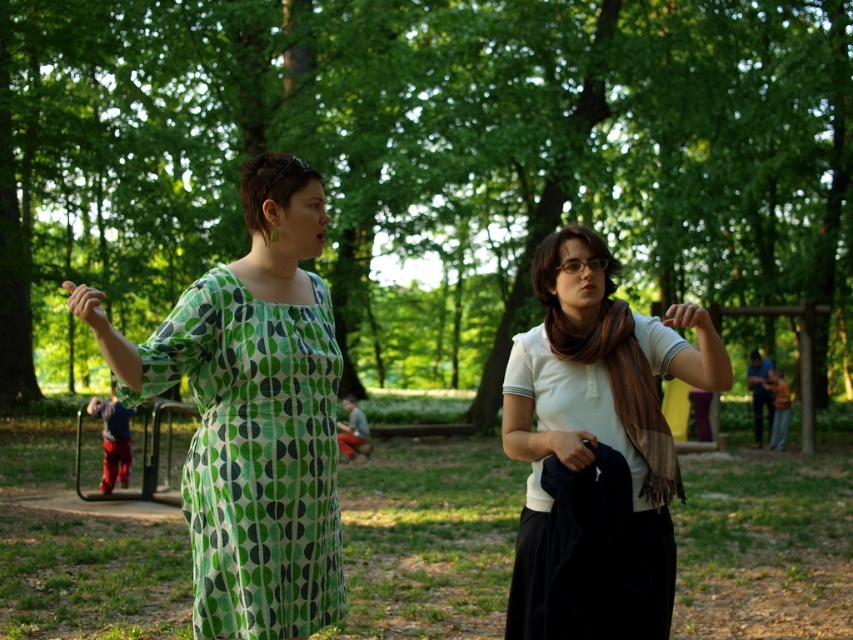
Which of these two, green dotted fabric dress at center or white cotton shirt at center, stands taller?

Standing taller between the two is white cotton shirt at center.

Who is shorter, green dotted fabric dress at center or white cotton shirt at center?

With less height is green dotted fabric dress at center.

Describe the element at coordinates (254, 456) in the screenshot. I see `green dotted fabric dress at center` at that location.

At what (x,y) coordinates should I click in order to perform the action: click on green dotted fabric dress at center. Please return your answer as a coordinate pair (x, y). Looking at the image, I should click on (254, 456).